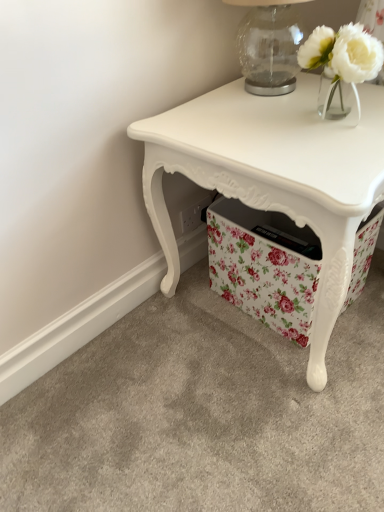
Question: From a real-world perspective, is white glossy table at center located higher than transparent glass table lamp at upper right?

Choices:
 (A) no
 (B) yes

Answer: (A)

Question: Is white glossy table at center smaller than transparent glass table lamp at upper right?

Choices:
 (A) no
 (B) yes

Answer: (A)

Question: From the image's perspective, is white glossy table at center on top of transparent glass table lamp at upper right?

Choices:
 (A) no
 (B) yes

Answer: (A)

Question: Is white glossy table at center with transparent glass table lamp at upper right?

Choices:
 (A) yes
 (B) no

Answer: (B)

Question: From a real-world perspective, is white glossy table at center located beneath transparent glass table lamp at upper right?

Choices:
 (A) yes
 (B) no

Answer: (A)

Question: From the image's perspective, relative to white glass vase at upper right, is white glossy table at center above or below?

Choices:
 (A) below
 (B) above

Answer: (A)

Question: Do you think white glossy table at center is within white glass vase at upper right, or outside of it?

Choices:
 (A) inside
 (B) outside

Answer: (B)

Question: Is white glossy table at center taller or shorter than white glass vase at upper right?

Choices:
 (A) short
 (B) tall

Answer: (B)

Question: Considering the positions of white glossy table at center and white glass vase at upper right in the image, is white glossy table at center bigger or smaller than white glass vase at upper right?

Choices:
 (A) small
 (B) big

Answer: (B)

Question: Considering their positions, is white glass vase at upper right located in front of or behind white glossy table at center?

Choices:
 (A) front
 (B) behind

Answer: (B)

Question: Looking at the image, does white glass vase at upper right seem bigger or smaller compared to white glossy table at center?

Choices:
 (A) small
 (B) big

Answer: (A)

Question: Considering the positions of point (332, 65) and point (225, 95), is point (332, 65) closer or farther from the camera than point (225, 95)?

Choices:
 (A) closer
 (B) farther

Answer: (A)

Question: Which is correct: white glass vase at upper right is inside white glossy table at center, or outside of it?

Choices:
 (A) inside
 (B) outside

Answer: (B)

Question: In terms of width, does white glossy table at center look wider or thinner when compared to transparent glass table lamp at upper right?

Choices:
 (A) thin
 (B) wide

Answer: (B)

Question: Does point (258, 195) appear closer or farther from the camera than point (241, 38)?

Choices:
 (A) closer
 (B) farther

Answer: (A)